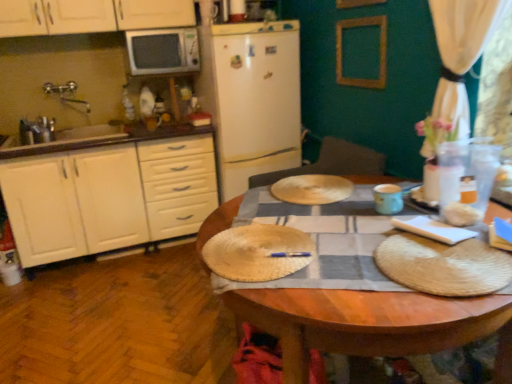
Image resolution: width=512 pixels, height=384 pixels. In order to click on free point below bamboo placemat at center (from a real-world perspective) in this screenshot , I will do `click(261, 248)`.